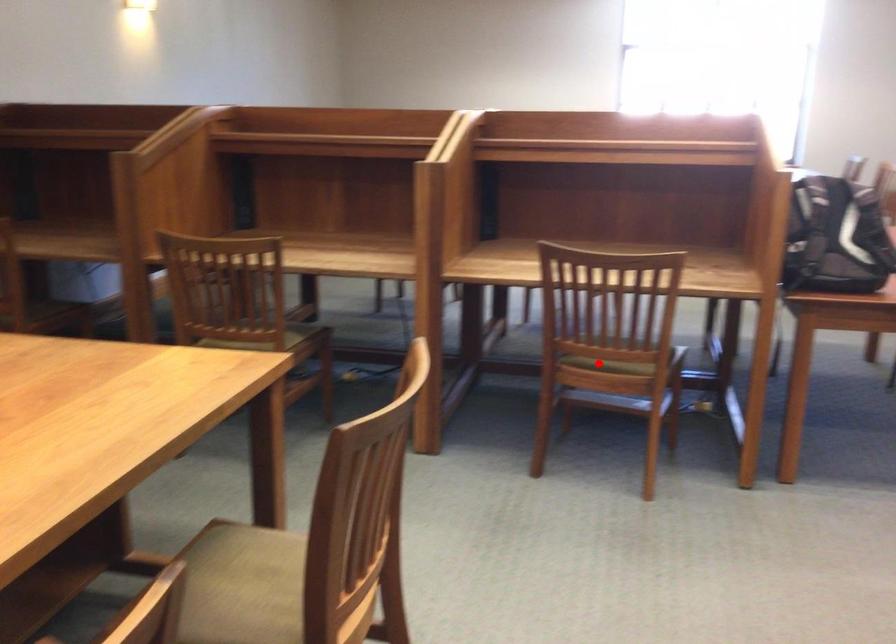
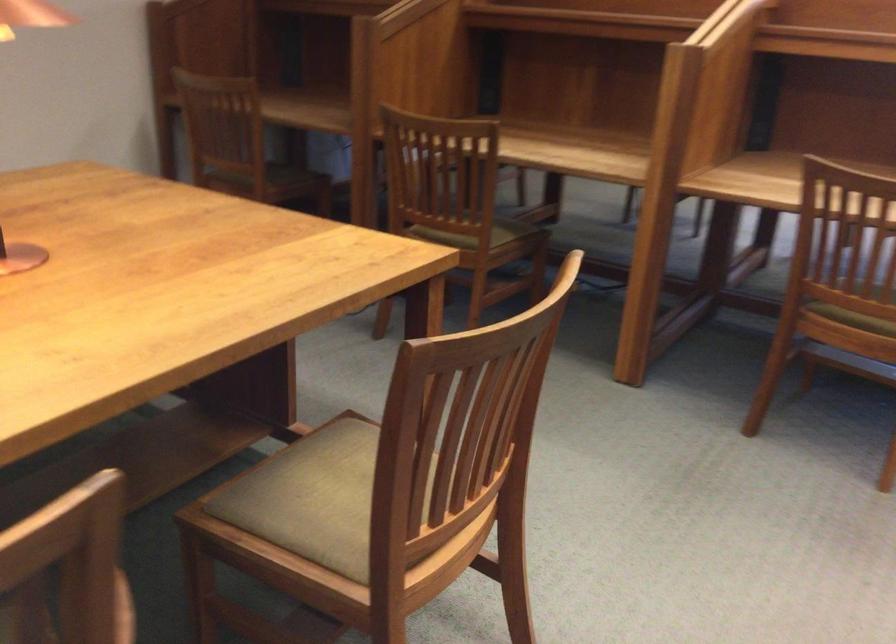
Locate, in the second image, the point that corresponds to the highlighted location in the first image.

(855, 313)